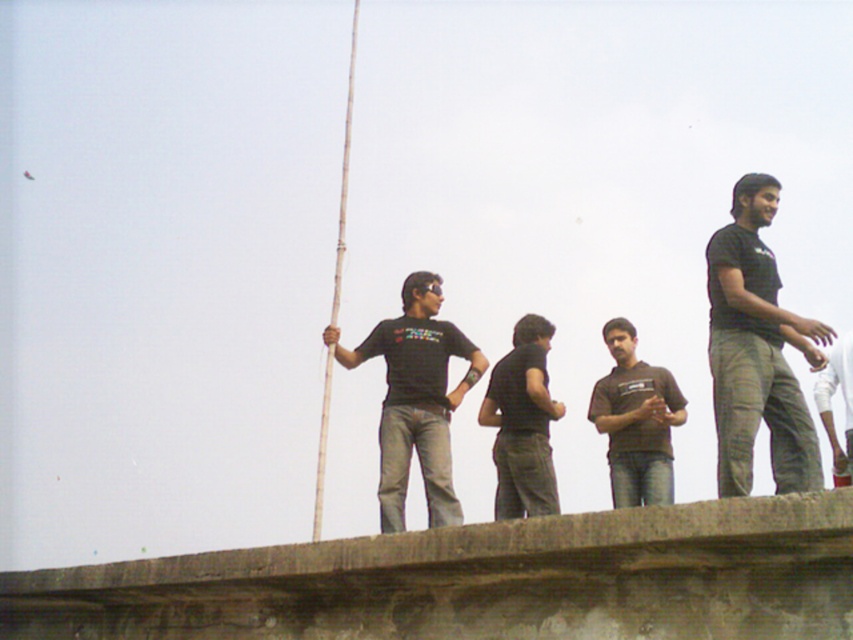
Describe the element at coordinates (636, 420) in the screenshot. I see `brown matte shirt at center` at that location.

Is point (616, 417) more distant than point (833, 458)?

Yes.

This screenshot has height=640, width=853. Find the location of `brown matte shirt at center`. brown matte shirt at center is located at coordinates (636, 420).

Between brown matte shirt at center and smooth bamboo pole at center, which one appears on the left side from the viewer's perspective?

smooth bamboo pole at center is more to the left.

Who is more forward, (630, 467) or (351, 40)?

Point (630, 467) is in front.

The image size is (853, 640). Identify the location of brown matte shirt at center. (636, 420).

Can you confirm if black cotton shirt at right is positioned above black matte shirt at center?

No.

Is black cotton shirt at right behind black matte shirt at center?

No, black cotton shirt at right is closer to the viewer.

Identify the location of black cotton shirt at right. (757, 349).

Image resolution: width=853 pixels, height=640 pixels. Find the location of `black cotton shirt at right`. black cotton shirt at right is located at coordinates (757, 349).